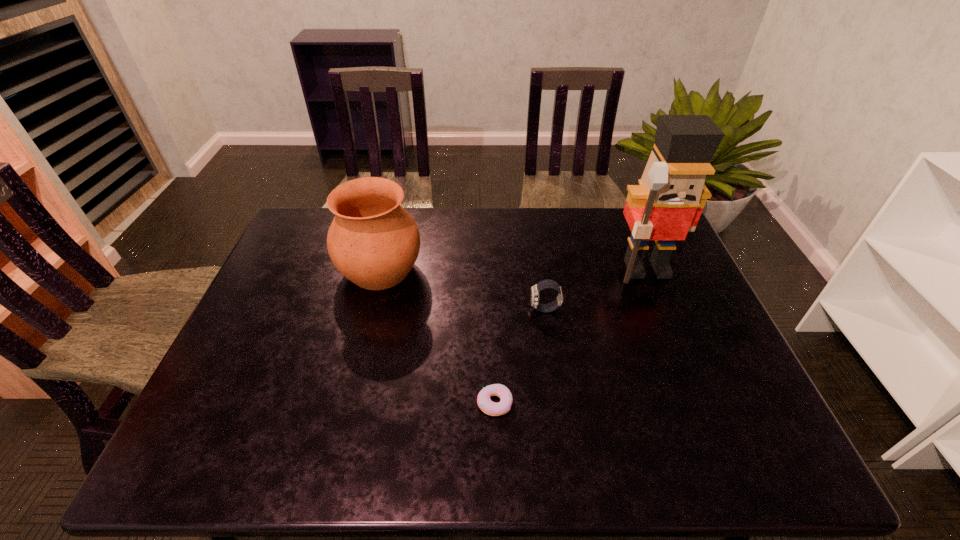
You are a GUI agent. You are given a task and a screenshot of the screen. Output one action in this format:
    pyautogui.click(x=<x>, y=<y>)
    Task: Click on the vacant region located 0.320m on the face of the third farthest object
    The image size is (960, 540).
    Given the screenshot: What is the action you would take?
    pyautogui.click(x=416, y=309)

Where is `free space located on the face of the third farthest object`? free space located on the face of the third farthest object is located at coordinates (472, 309).

Identify the location of free space located 0.290m on the face of the third farthest object. This screenshot has height=540, width=960. (426, 309).

Locate an element on the screen. This screenshot has height=540, width=960. blank area located 0.200m on the left of the third object from right to left is located at coordinates (391, 403).

Find the location of a particular element. nutcracker at the far edge is located at coordinates 668,202.

The width and height of the screenshot is (960, 540). In order to click on pottery that is at the far edge in this screenshot , I will do `click(373, 241)`.

The height and width of the screenshot is (540, 960). In order to click on object that is positioned at the right edge in this screenshot , I will do `click(668, 202)`.

Locate an element on the screen. This screenshot has height=540, width=960. object that is at the far right corner is located at coordinates (668, 202).

The image size is (960, 540). I want to click on vacant space at the far edge of the desktop, so click(444, 237).

Where is `vacant point at the near edge`? This screenshot has width=960, height=540. vacant point at the near edge is located at coordinates (612, 443).